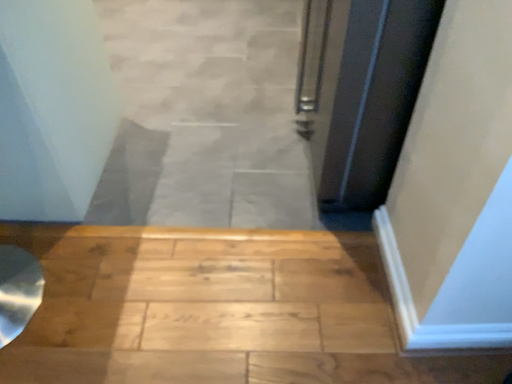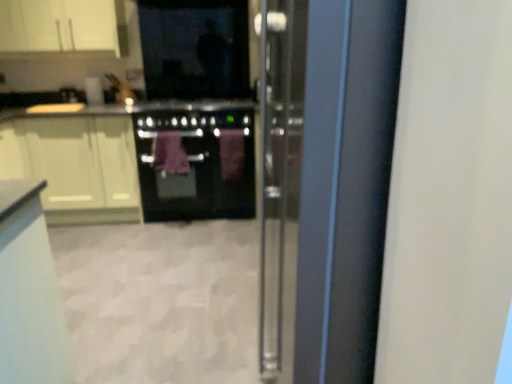
Question: Which way did the camera rotate in the video?

Choices:
 (A) rotated downward
 (B) rotated upward

Answer: (B)